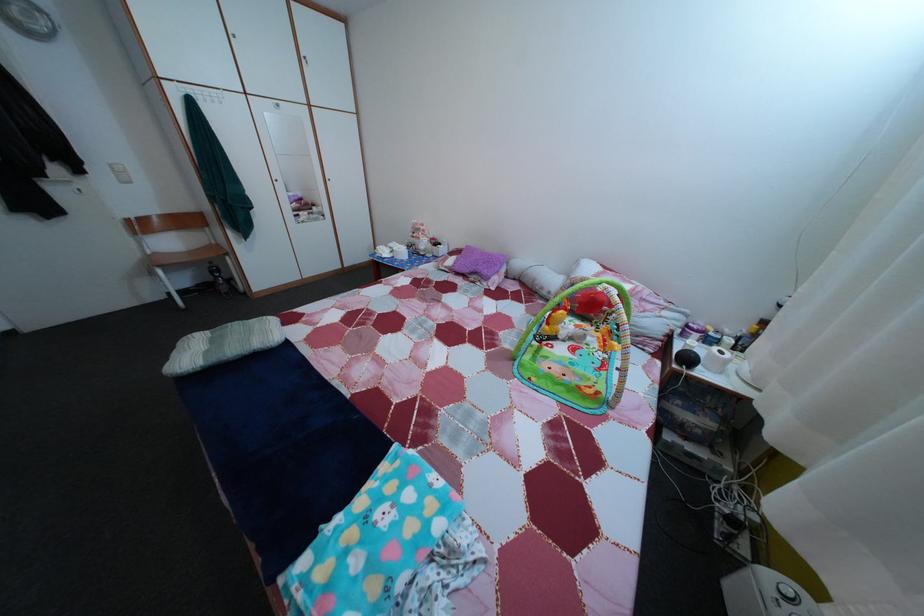
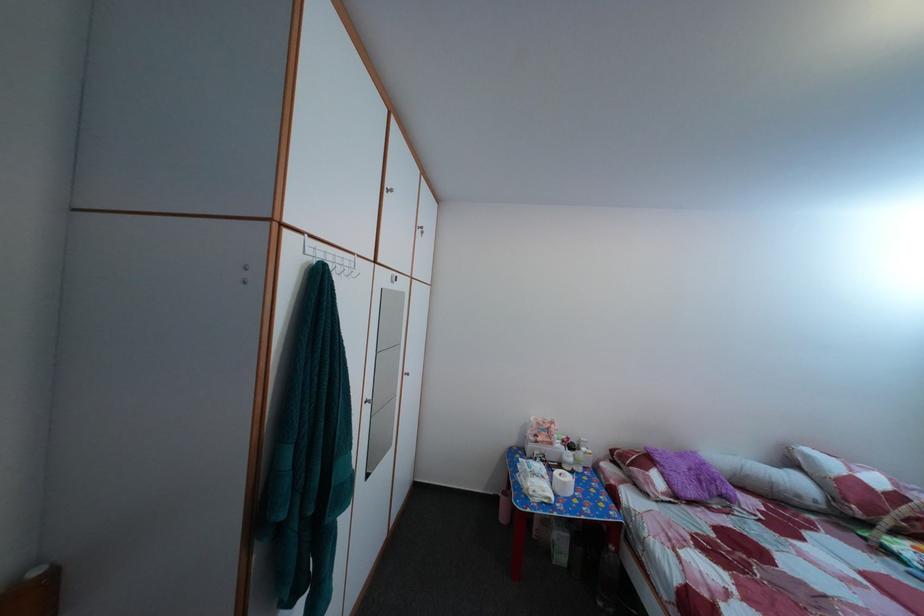
Find the pixel in the second image that matches [390,260] in the first image.

(551, 500)